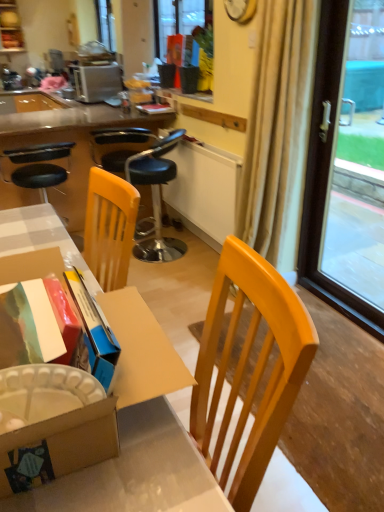
Question: Does point (16, 500) appear closer or farther from the camera than point (362, 59)?

Choices:
 (A) closer
 (B) farther

Answer: (A)

Question: From the image's perspective, is wooden desk at center, which appears as the first desk when ordered from the bottom, positioned above or below transparent glass window at right?

Choices:
 (A) below
 (B) above

Answer: (A)

Question: Considering the real-world distances, which object is closest to the beige fabric curtain at right?

Choices:
 (A) black leather bar stool at left, positioned as the 1th chair in left-to-right order
 (B) satin silver toaster at upper left
 (C) black leather stool at center, the first chair from the right
 (D) matte black desk at center, which ranks as the 1th desk in top-to-bottom order
 (E) wooden desk at center, which appears as the first desk when ordered from the bottom

Answer: (C)

Question: Estimate the real-world distances between objects in this image. Which object is farther from the matte black desk at center, the 2th desk from the bottom?

Choices:
 (A) black leather stool at center, which is the 2th chair from left to right
 (B) transparent glass window at right
 (C) beige fabric curtain at right
 (D) wooden desk at center, which appears as the first desk when ordered from the bottom
 (E) matte black flowerpot at upper center

Answer: (B)